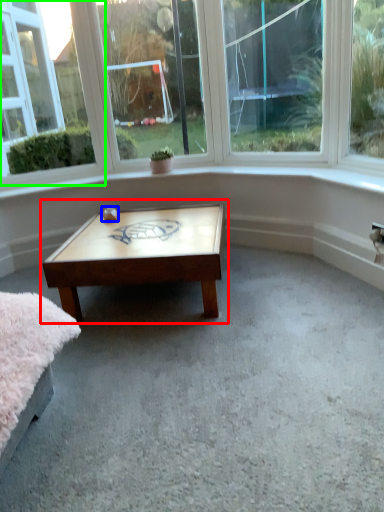
Question: Based on their relative distances, which object is nearer to coffee table (highlighted by a red box)? Choose from table (highlighted by a blue box) and window (highlighted by a green box).

Choices:
 (A) table
 (B) window

Answer: (A)